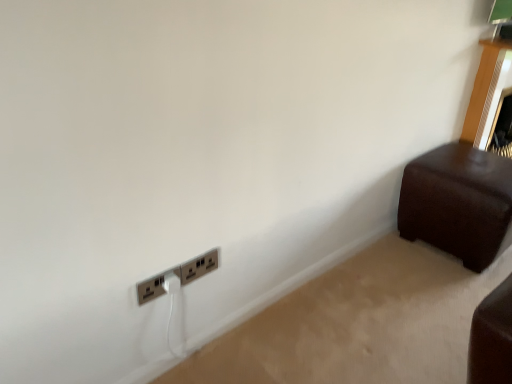
Question: Looking at their shapes, would you say brown leather ottoman at right is wider or thinner than satin silver power plugs and sockets at lower left, placed as the 2th power plugs and sockets when sorted from left to right?

Choices:
 (A) thin
 (B) wide

Answer: (B)

Question: From the image's perspective, is brown leather ottoman at right located above or below satin silver power plugs and sockets at lower left, placed as the 2th power plugs and sockets when sorted from left to right?

Choices:
 (A) below
 (B) above

Answer: (B)

Question: Considering the real-world distances, which object is farthest from the satin silver power plugs and sockets at lower left, placed as the 2th power plugs and sockets when sorted from left to right?

Choices:
 (A) brown leather ottoman at right
 (B) metallic silver power plugs and sockets at lower left, the 1th power plugs and sockets in the left-to-right sequence

Answer: (A)

Question: Estimate the real-world distances between objects in this image. Which object is closer to the metallic silver power plugs and sockets at lower left, the 1th power plugs and sockets in the left-to-right sequence?

Choices:
 (A) brown leather ottoman at right
 (B) satin silver power plugs and sockets at lower left, which is the 1th power plugs and sockets from right to left

Answer: (B)